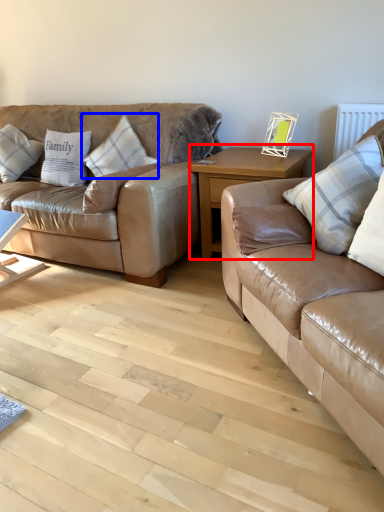
Question: Which object appears closest to the camera in this image, table (highlighted by a red box) or pillow (highlighted by a blue box)?

Choices:
 (A) table
 (B) pillow

Answer: (A)